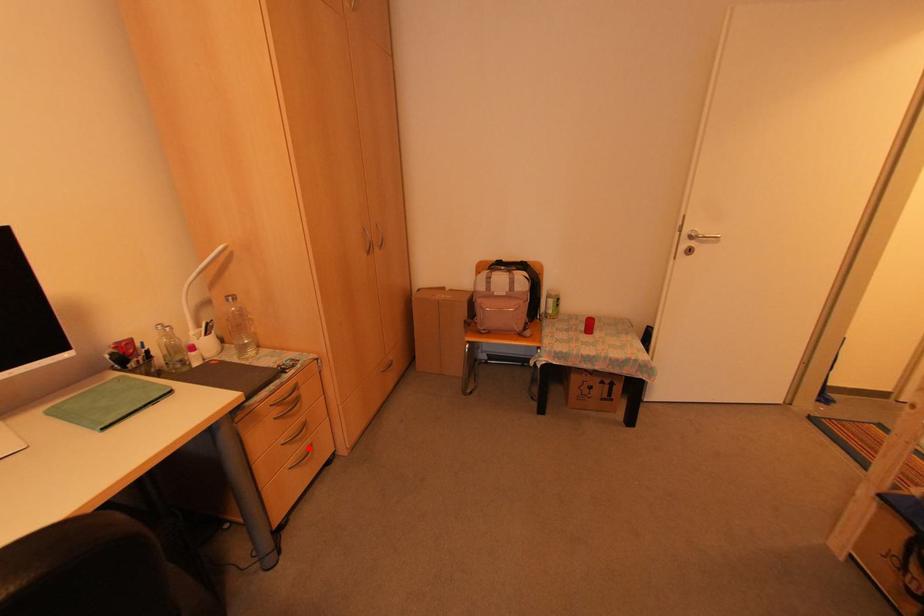
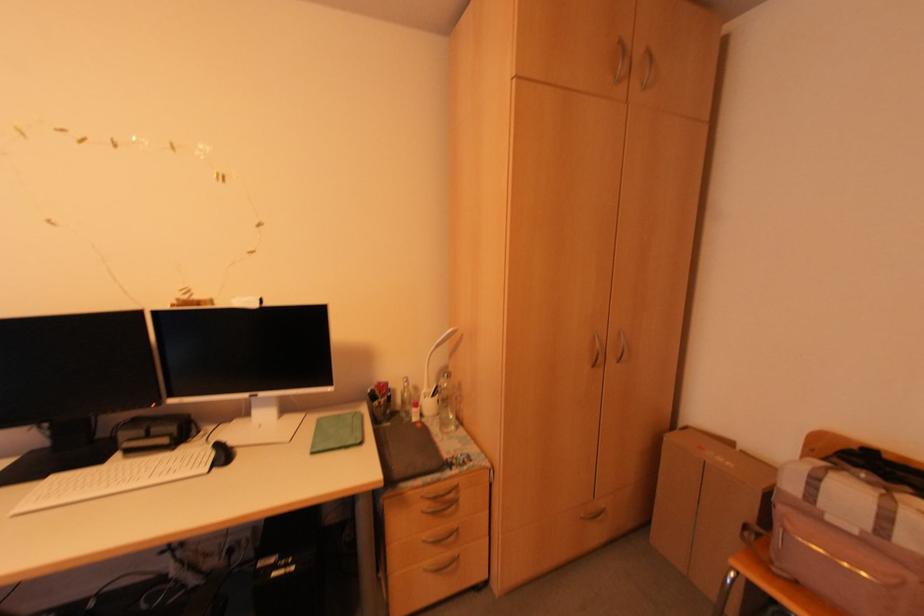
Locate, in the second image, the point that corresponds to the highlighted location in the first image.

(454, 559)